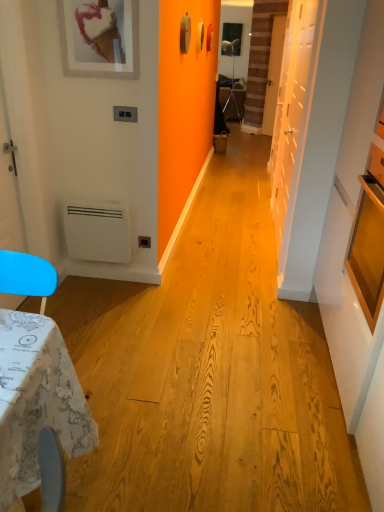
Question: Is there a large distance between white matte heater at lower left and white matte picture frame at upper left?

Choices:
 (A) no
 (B) yes

Answer: (A)

Question: Is white matte heater at lower left positioned with its back to white matte picture frame at upper left?

Choices:
 (A) yes
 (B) no

Answer: (B)

Question: Would you say white matte heater at lower left contains white matte picture frame at upper left?

Choices:
 (A) yes
 (B) no

Answer: (B)

Question: Is white matte heater at lower left taller than white matte picture frame at upper left?

Choices:
 (A) no
 (B) yes

Answer: (B)

Question: Is the depth of white matte heater at lower left less than that of white matte picture frame at upper left?

Choices:
 (A) yes
 (B) no

Answer: (B)

Question: Does point (71, 248) appear closer or farther from the camera than point (304, 30)?

Choices:
 (A) farther
 (B) closer

Answer: (B)

Question: In terms of width, does white matte heater at lower left look wider or thinner when compared to white matte door at right, which ranks as the second door in top-to-bottom order?

Choices:
 (A) thin
 (B) wide

Answer: (B)

Question: From the image's perspective, relative to white matte door at right, placed as the 2th door when sorted from right to left, is white matte heater at lower left above or below?

Choices:
 (A) below
 (B) above

Answer: (A)

Question: Is white matte heater at lower left inside the boundaries of white matte door at right, positioned as the 1th door in left-to-right order, or outside?

Choices:
 (A) inside
 (B) outside

Answer: (B)

Question: From a real-world perspective, is white matte picture frame at upper left positioned above or below white matte heater at lower left?

Choices:
 (A) above
 (B) below

Answer: (A)

Question: Relative to white matte heater at lower left, is white matte picture frame at upper left in front or behind?

Choices:
 (A) front
 (B) behind

Answer: (A)

Question: From the image's perspective, relative to white matte heater at lower left, is white matte picture frame at upper left above or below?

Choices:
 (A) above
 (B) below

Answer: (A)

Question: Based on their positions, is white matte picture frame at upper left located to the left or right of white matte heater at lower left?

Choices:
 (A) right
 (B) left

Answer: (A)

Question: In terms of size, does white matte heater at lower left appear bigger or smaller than white matte picture frame at upper left?

Choices:
 (A) big
 (B) small

Answer: (A)

Question: In the image, is white matte heater at lower left on the left side or the right side of white matte picture frame at upper left?

Choices:
 (A) left
 (B) right

Answer: (A)